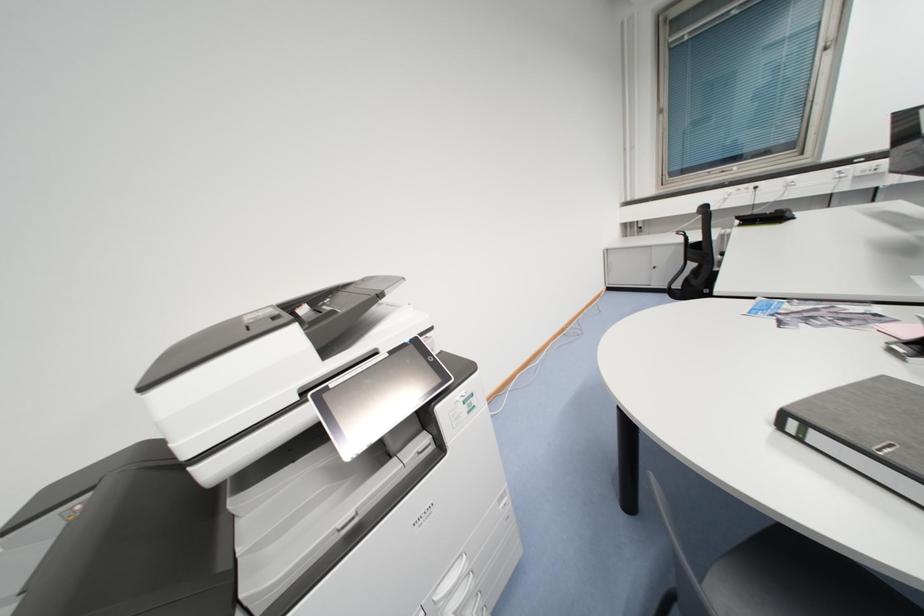
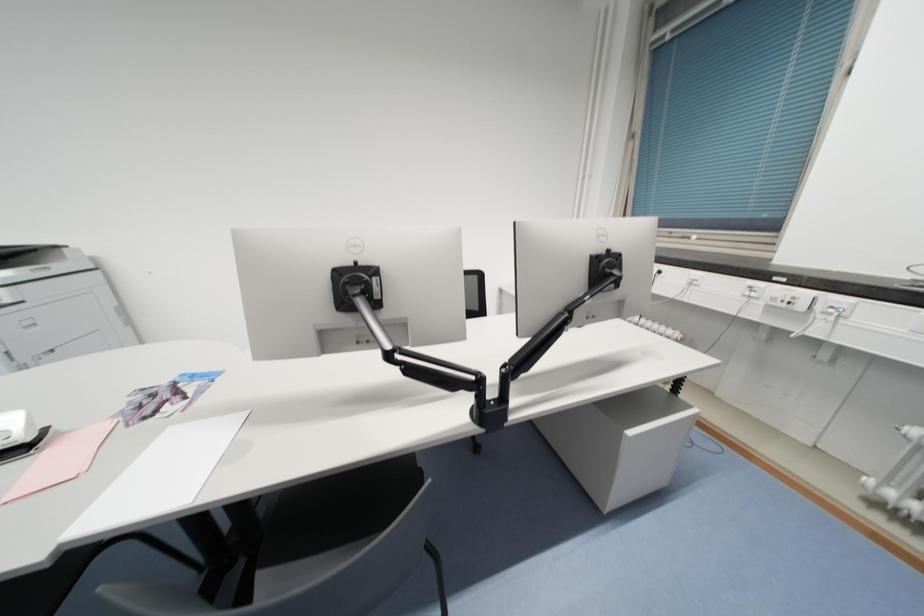
Question: In a continuous first-person perspective shot, in which direction is the camera moving?

Choices:
 (A) Left
 (B) Right
 (C) Forward
 (D) Backward

Answer: (B)